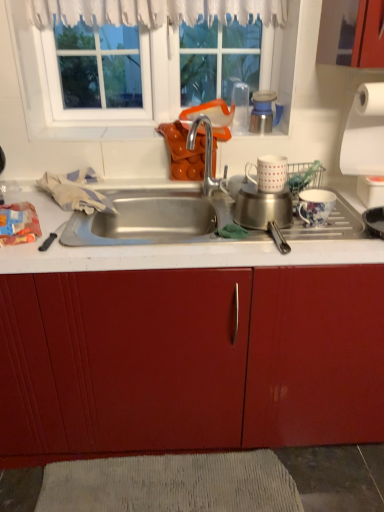
What do you see at coordinates (315, 206) in the screenshot?
I see `floral porcelain mug at right, the 1th coffee cup in the right-to-left sequence` at bounding box center [315, 206].

What do you see at coordinates (264, 112) in the screenshot? The width and height of the screenshot is (384, 512). I see `brushed metal cup at upper center` at bounding box center [264, 112].

Image resolution: width=384 pixels, height=512 pixels. What do you see at coordinates (364, 133) in the screenshot? I see `white paper at right` at bounding box center [364, 133].

Where is `white textured mat at lower center`? The width and height of the screenshot is (384, 512). white textured mat at lower center is located at coordinates (171, 484).

Consider the image. Measure the distance between point [260,159] and camera.

A distance of 4.70 feet exists between point [260,159] and camera.

What do you see at coordinates (206, 155) in the screenshot?
I see `silver metallic faucet at center` at bounding box center [206, 155].

Locate an element on the screen. The width and height of the screenshot is (384, 512). floral porcelain mug at right, the 1th coffee cup in the right-to-left sequence is located at coordinates (315, 206).

Is white textured mat at lower center at the back of white matte coffee cup at upper center, marked as the second coffee cup in a right-to-left arrangement?

No.

From the image's perspective, which is above, white matte coffee cup at upper center, arranged as the 2th coffee cup when ordered from the bottom, or white textured mat at lower center?

white matte coffee cup at upper center, arranged as the 2th coffee cup when ordered from the bottom.

Is white matte coffee cup at upper center, marked as the second coffee cup in a right-to-left arrangement, taller than white textured mat at lower center?

Yes, white matte coffee cup at upper center, marked as the second coffee cup in a right-to-left arrangement, is taller than white textured mat at lower center.

Consider the image. Can you confirm if white matte coffee cup at upper center, marked as the second coffee cup in a right-to-left arrangement, is bigger than white textured mat at lower center?

No, white matte coffee cup at upper center, marked as the second coffee cup in a right-to-left arrangement, is not bigger than white textured mat at lower center.

From a real-world perspective, which object stands above the other?

white glass window at upper center is physically above.

Considering the positions of objects silver metallic faucet at center and white glass window at upper center in the image provided, who is behind, silver metallic faucet at center or white glass window at upper center?

Positioned behind is white glass window at upper center.

Looking at this image, would you say silver metallic faucet at center is inside or outside white glass window at upper center?

silver metallic faucet at center lies outside white glass window at upper center.

From the image's perspective, between silver metallic faucet at center and white glass window at upper center, which one is located above?

From the image's view, white glass window at upper center is above.

Is silver metallic faucet at center facing towards white matte coffee cup at upper center, marked as the second coffee cup in a right-to-left arrangement?

No, silver metallic faucet at center is not oriented towards white matte coffee cup at upper center, marked as the second coffee cup in a right-to-left arrangement.

Considering the sizes of silver metallic faucet at center and white matte coffee cup at upper center, marked as the second coffee cup in a right-to-left arrangement, in the image, is silver metallic faucet at center taller or shorter than white matte coffee cup at upper center, marked as the second coffee cup in a right-to-left arrangement,?

In the image, silver metallic faucet at center appears to be taller than white matte coffee cup at upper center, marked as the second coffee cup in a right-to-left arrangement.

Where is `tap on the left of the white matte coffee cup at upper center, marked as the second coffee cup in a right-to-left arrangement`? tap on the left of the white matte coffee cup at upper center, marked as the second coffee cup in a right-to-left arrangement is located at coordinates (206, 155).

From a real-world perspective, is silver metallic faucet at center physically above white matte coffee cup at upper center, arranged as the 2th coffee cup when ordered from the bottom?

Incorrect, from a real-world perspective, silver metallic faucet at center is lower than white matte coffee cup at upper center, arranged as the 2th coffee cup when ordered from the bottom.

Locate an element on the screen. The width and height of the screenshot is (384, 512). coffee cup that is the 2nd one below the white paper at right (from a real-world perspective) is located at coordinates (315, 206).

Is floral porcelain mug at right, the second coffee cup positioned from the top, not within white paper at right?

Yes.

In the scene shown: Could you tell me if floral porcelain mug at right, the 1th coffee cup in the right-to-left sequence, is turned towards white paper at right?

No, floral porcelain mug at right, the 1th coffee cup in the right-to-left sequence, is not aimed at white paper at right.

Is floral porcelain mug at right, the 1th coffee cup in the right-to-left sequence, next to white paper at right?

They are not placed beside each other.

Which of these two, white paper at right or white matte coffee cup at upper center, arranged as the 2th coffee cup when ordered from the bottom, is bigger?

With larger size is white paper at right.

From the image's perspective, is white paper at right positioned above or below white matte coffee cup at upper center, marked as the second coffee cup in a right-to-left arrangement?

white paper at right is situated higher than white matte coffee cup at upper center, marked as the second coffee cup in a right-to-left arrangement, in the image.

Looking at this image, could you tell me if white paper at right is turned towards white matte coffee cup at upper center, which ranks as the 1th coffee cup in top-to-bottom order?

No, white paper at right is not aimed at white matte coffee cup at upper center, which ranks as the 1th coffee cup in top-to-bottom order.

Based on the photo, can you confirm if floral porcelain mug at right, positioned as the 2th coffee cup in left-to-right order, is shorter than white matte coffee cup at upper center, the 1th coffee cup viewed from the left?

No, floral porcelain mug at right, positioned as the 2th coffee cup in left-to-right order, is not shorter than white matte coffee cup at upper center, the 1th coffee cup viewed from the left.

Is point (330, 196) more distant than point (249, 178)?

No, (330, 196) is closer to viewer.

Is the depth of floral porcelain mug at right, which ranks as the 1th coffee cup in bottom-to-top order, less than that of white matte coffee cup at upper center, marked as the second coffee cup in a right-to-left arrangement?

No, the depth of floral porcelain mug at right, which ranks as the 1th coffee cup in bottom-to-top order, is greater than that of white matte coffee cup at upper center, marked as the second coffee cup in a right-to-left arrangement.

How much distance is there between white glass window at upper center and white paper at right?

white glass window at upper center is 56.32 centimeters away from white paper at right.

Does white glass window at upper center turn towards white paper at right?

Yes, white glass window at upper center faces towards white paper at right.

From the image's perspective, which one is positioned higher, white glass window at upper center or white paper at right?

From the image's view, white glass window at upper center is above.

Is white glass window at upper center next to white paper at right?

white glass window at upper center is not next to white paper at right, and they're not touching.

The height and width of the screenshot is (512, 384). I want to click on plain beneath the white matte coffee cup at upper center, which ranks as the 1th coffee cup in top-to-bottom order (from a real-world perspective), so click(x=171, y=484).

Locate an element on the screen. This screenshot has height=512, width=384. window that is on the left side of silver metallic faucet at center is located at coordinates (142, 73).

Based on their spatial positions, is brushed metal cup at upper center or white matte coffee cup at upper center, which ranks as the 1th coffee cup in top-to-bottom order, further from white paper at right?

white matte coffee cup at upper center, which ranks as the 1th coffee cup in top-to-bottom order.

Looking at this image, from the image, which object appears to be nearer to silver metallic faucet at center, white paper at right or white glass window at upper center?

white glass window at upper center is positioned closer to the anchor silver metallic faucet at center.

When comparing their distances from white textured mat at lower center, does silver metallic faucet at center or floral porcelain mug at right, the 1th coffee cup in the right-to-left sequence, seem closer?

Based on the image, floral porcelain mug at right, the 1th coffee cup in the right-to-left sequence, appears to be nearer to white textured mat at lower center.

Looking at the image, which one is located further to floral porcelain mug at right, the second coffee cup positioned from the top, brushed metal cup at upper center or white glass window at upper center?

white glass window at upper center lies further to floral porcelain mug at right, the second coffee cup positioned from the top, than the other object.

Estimate the real-world distances between objects in this image. Which object is closer to silver metallic faucet at center, white textured mat at lower center or white matte coffee cup at upper center, which ranks as the 1th coffee cup in top-to-bottom order?

Based on the image, white matte coffee cup at upper center, which ranks as the 1th coffee cup in top-to-bottom order, appears to be nearer to silver metallic faucet at center.

When comparing their distances from silver metallic faucet at center, does white matte coffee cup at upper center, arranged as the 2th coffee cup when ordered from the bottom, or white glass window at upper center seem closer?

The object closer to silver metallic faucet at center is white matte coffee cup at upper center, arranged as the 2th coffee cup when ordered from the bottom.

When comparing their distances from white matte coffee cup at upper center, the 1th coffee cup viewed from the left, does brushed metal cup at upper center or floral porcelain mug at right, which ranks as the 1th coffee cup in bottom-to-top order, seem further?

Among the two, brushed metal cup at upper center is located further to white matte coffee cup at upper center, the 1th coffee cup viewed from the left.

When comparing their distances from white matte coffee cup at upper center, arranged as the 2th coffee cup when ordered from the bottom, does white paper at right or floral porcelain mug at right, positioned as the 2th coffee cup in left-to-right order, seem closer?

Among the two, floral porcelain mug at right, positioned as the 2th coffee cup in left-to-right order, is located nearer to white matte coffee cup at upper center, arranged as the 2th coffee cup when ordered from the bottom.

What are the coordinates of `paper towel between white glass window at upper center and white textured mat at lower center from top to bottom` in the screenshot? It's located at (364, 133).

At what (x,y) coordinates should I click in order to perform the action: click on appliance between white glass window at upper center and white matte coffee cup at upper center, arranged as the 2th coffee cup when ordered from the bottom, vertically. Please return your answer as a coordinate pair (x, y). This screenshot has height=512, width=384. Looking at the image, I should click on (264, 112).

The image size is (384, 512). I want to click on coffee cup situated between silver metallic faucet at center and floral porcelain mug at right, the 1th coffee cup in the right-to-left sequence, from left to right, so click(269, 173).

You are a GUI agent. You are given a task and a screenshot of the screen. Output one action in this format:
    pyautogui.click(x=<x>, y=<y>)
    Task: Click on the tap between white glass window at upper center and white matte coffee cup at upper center, marked as the second coffee cup in a right-to-left arrangement, in the vertical direction
    
    Given the screenshot: What is the action you would take?
    pyautogui.click(x=206, y=155)